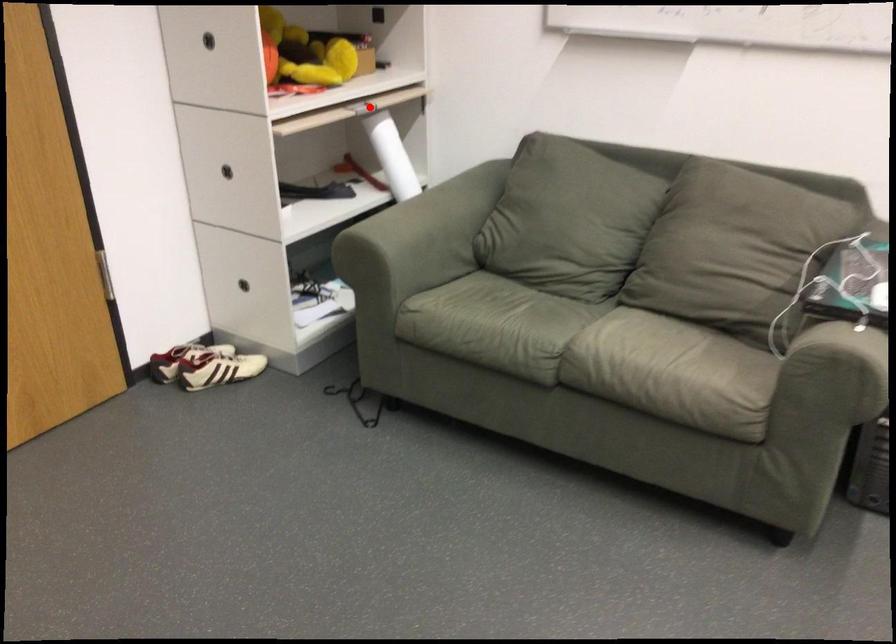
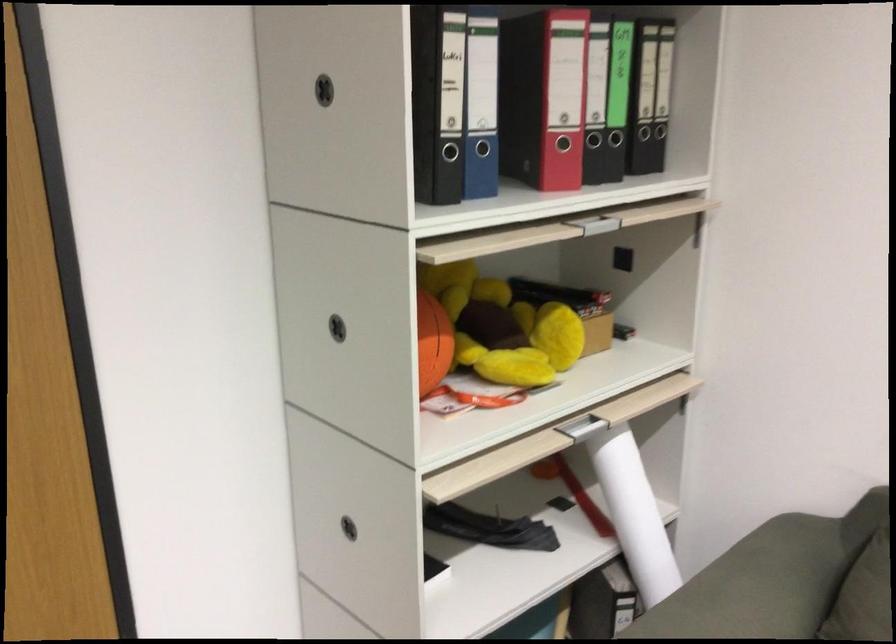
The point at the highlighted location is marked in the first image. Where is the corresponding point in the second image?

(595, 421)